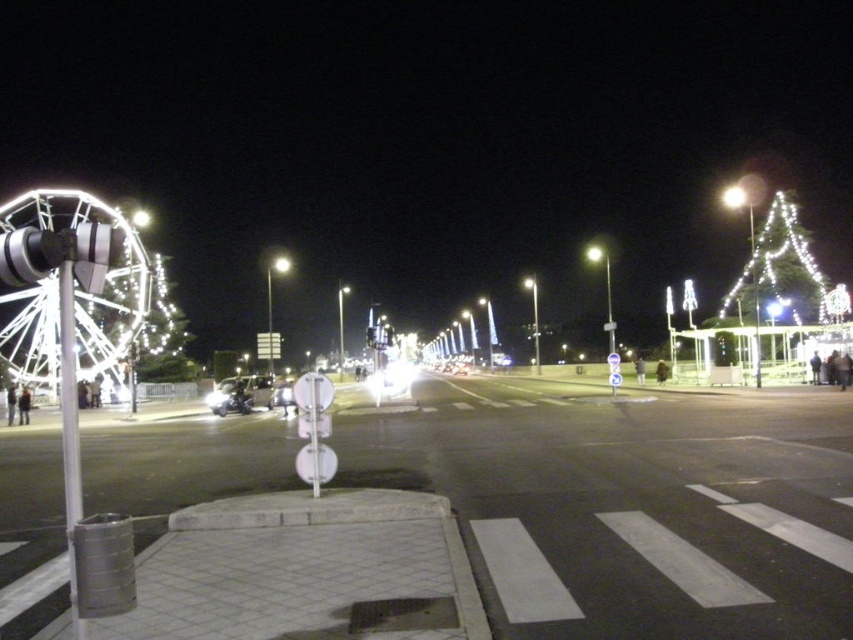
Question: Is shiny silver car at center below bright metallic streetlight at upper right?

Choices:
 (A) yes
 (B) no

Answer: (A)

Question: Which object appears farthest from the camera in this image?

Choices:
 (A) illuminated plastic tree at right
 (B) white illuminated ferris wheel at left
 (C) bright metallic streetlight at upper right
 (D) shiny silver car at center

Answer: (C)

Question: Which is nearer to the illuminated plastic tree at right?

Choices:
 (A) shiny silver car at center
 (B) bright metallic streetlight at upper right
 (C) white illuminated ferris wheel at left

Answer: (A)

Question: Which of the following is the farthest from the observer?

Choices:
 (A) (810, 288)
 (B) (91, 380)
 (C) (726, 195)

Answer: (C)

Question: Does white illuminated ferris wheel at left have a larger size compared to bright metallic streetlight at upper right?

Choices:
 (A) yes
 (B) no

Answer: (A)

Question: Can you confirm if white illuminated ferris wheel at left is smaller than illuminated plastic tree at right?

Choices:
 (A) no
 (B) yes

Answer: (A)